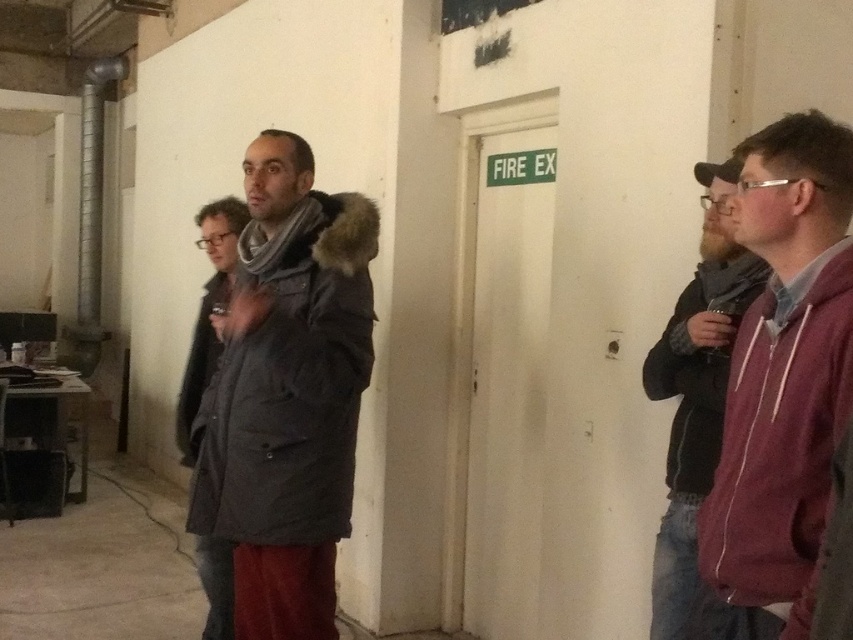
Is dark gray fur-lined coat at center bigger than maroon zip-up hoodie at right?

Indeed, dark gray fur-lined coat at center has a larger size compared to maroon zip-up hoodie at right.

Is dark gray fur-lined coat at center above maroon zip-up hoodie at right?

Incorrect, dark gray fur-lined coat at center is not positioned above maroon zip-up hoodie at right.

Is point (267, 304) closer to viewer compared to point (846, 291)?

No.

Find the location of a particular element. Image resolution: width=853 pixels, height=640 pixels. dark gray fur-lined coat at center is located at coordinates pyautogui.click(x=283, y=397).

Between point (691, 602) and point (202, 304), which one is positioned behind?

Positioned behind is point (202, 304).

Is point (648, 372) farther from camera compared to point (199, 556)?

No, (648, 372) is in front of (199, 556).

Is point (720, 371) positioned before point (213, 298)?

Yes, point (720, 371) is in front of point (213, 298).

Where is `maroon fleece jacket at right`? maroon fleece jacket at right is located at coordinates (698, 410).

Which is more to the left, maroon zip-up hoodie at right or dark gray wool coat at center?

From the viewer's perspective, dark gray wool coat at center appears more on the left side.

Is maroon zip-up hoodie at right bigger than dark gray wool coat at center?

Yes.

What do you see at coordinates (784, 372) in the screenshot? The image size is (853, 640). I see `maroon zip-up hoodie at right` at bounding box center [784, 372].

Where is `maroon zip-up hoodie at right`? maroon zip-up hoodie at right is located at coordinates (784, 372).